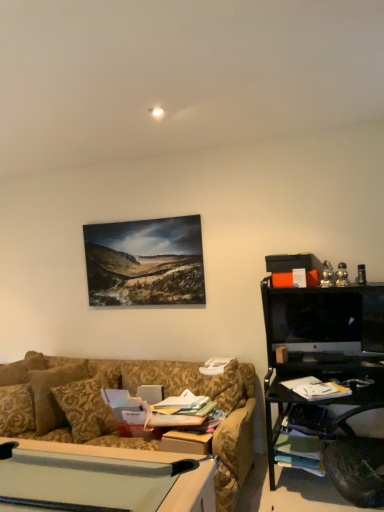
Question: From the image's perspective, is black glossy monitor at right above or below gold damask pillow at center?

Choices:
 (A) above
 (B) below

Answer: (A)

Question: Considering their positions, is black glossy monitor at right located in front of or behind gold damask pillow at center?

Choices:
 (A) behind
 (B) front

Answer: (A)

Question: Visually, is black glossy monitor at right positioned to the left or to the right of gold damask pillow at center?

Choices:
 (A) right
 (B) left

Answer: (A)

Question: Considering the positions of point click(82, 394) and point click(314, 304), is point click(82, 394) closer or farther from the camera than point click(314, 304)?

Choices:
 (A) closer
 (B) farther

Answer: (A)

Question: Which is correct: gold damask pillow at center is inside black glossy monitor at right, or outside of it?

Choices:
 (A) inside
 (B) outside

Answer: (B)

Question: Is gold damask pillow at center taller or shorter than black glossy monitor at right?

Choices:
 (A) tall
 (B) short

Answer: (A)

Question: Is gold damask pillow at center bigger or smaller than black glossy monitor at right?

Choices:
 (A) big
 (B) small

Answer: (A)